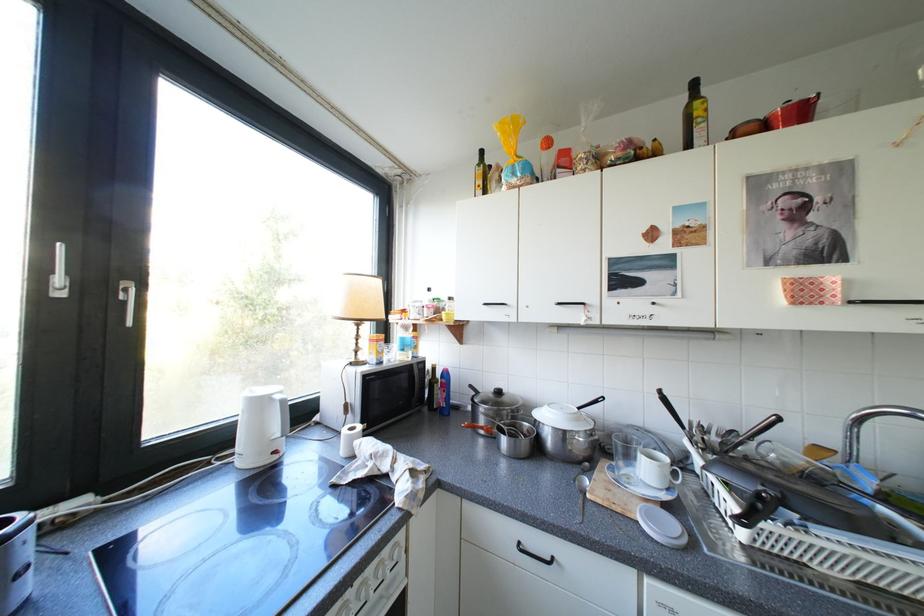
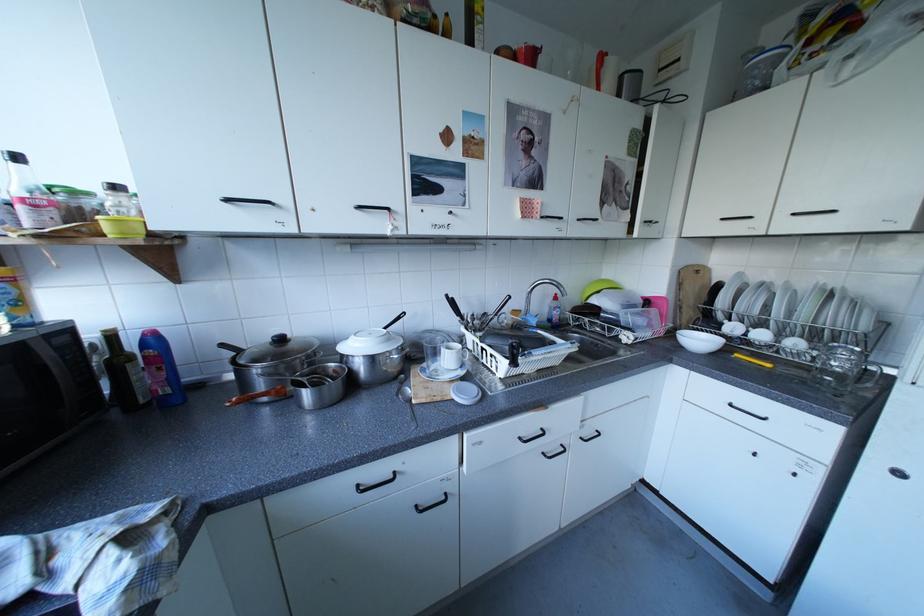
Find the pixel in the second image that matches pixel 497 304 in the first image.

(240, 200)